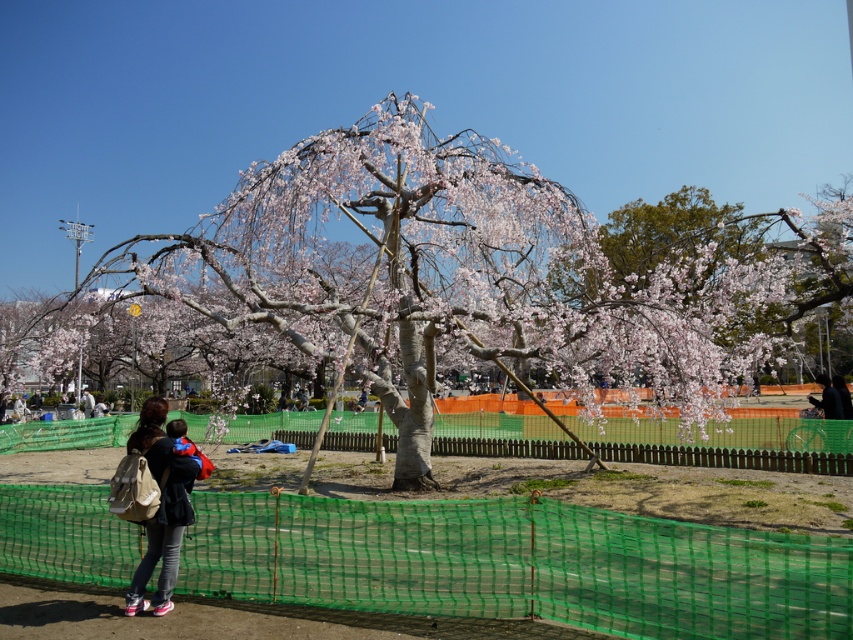
Between point (791, 545) and point (141, 561), which one is positioned in front?

Point (791, 545) is in front.

Is point (602, 556) behind point (151, 432)?

No, it is not.

Locate an element on the screen. green mesh net at lower center is located at coordinates (520, 564).

Between pink blossoming tree at center and matte beige backpack at lower left, which one is positioned lower?

matte beige backpack at lower left is below.

Between point (306, 164) and point (134, 605), which one is positioned behind?

Point (306, 164)

Where is `pink blossoming tree at center`? pink blossoming tree at center is located at coordinates pyautogui.click(x=469, y=300).

Which is in front, point (178, 528) or point (824, 378)?

Point (178, 528)

Is point (149, 548) positioned behind point (831, 404)?

No, it is in front of (831, 404).

This screenshot has width=853, height=640. I want to click on matte beige backpack at lower left, so click(x=160, y=508).